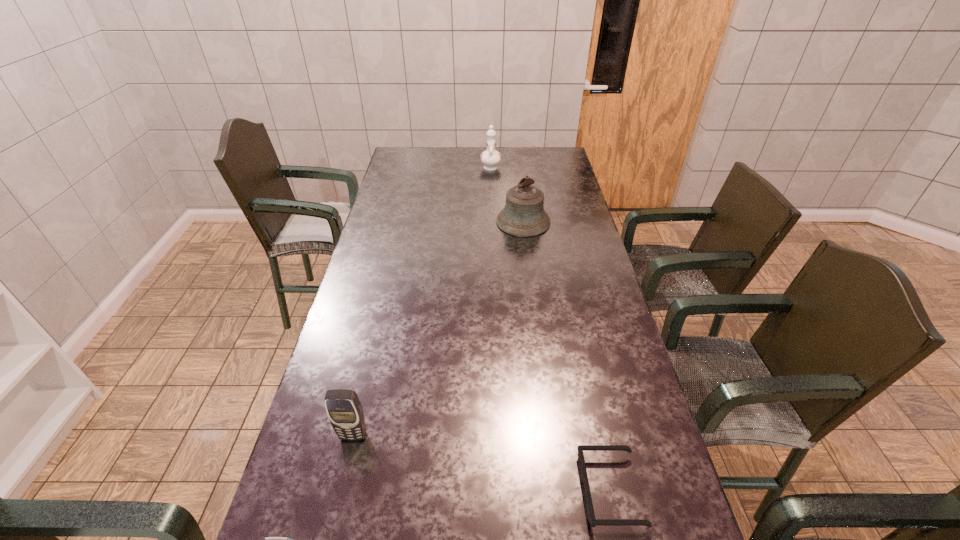
Identify the location of unoccupied area between the chinaware and the third shortest object. 422,301.

Find the location of a particular element. The height and width of the screenshot is (540, 960). blank region between the bell and the sunglasses is located at coordinates (566, 356).

Locate an element on the screen. The height and width of the screenshot is (540, 960). the closest object relative to the bell is located at coordinates (490, 158).

Select which object appears as the third closest to the farther cellular telephone. Please provide its 2D coordinates. Your answer should be formatted as a tuple, i.e. [(x, y)], where the tuple contains the x and y coordinates of a point satisfying the conditions above.

[(523, 215)]